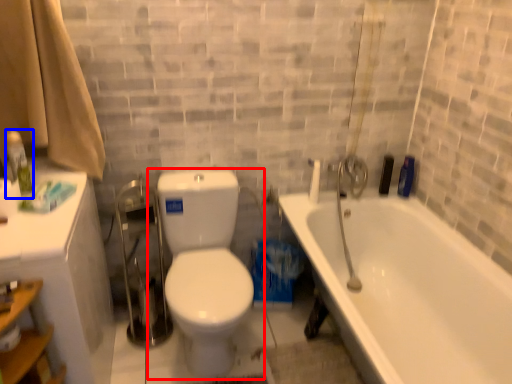
Question: Among these objects, which one is nearest to the camera, toilet (highlighted by a red box) or toiletry (highlighted by a blue box)?

Choices:
 (A) toilet
 (B) toiletry

Answer: (A)